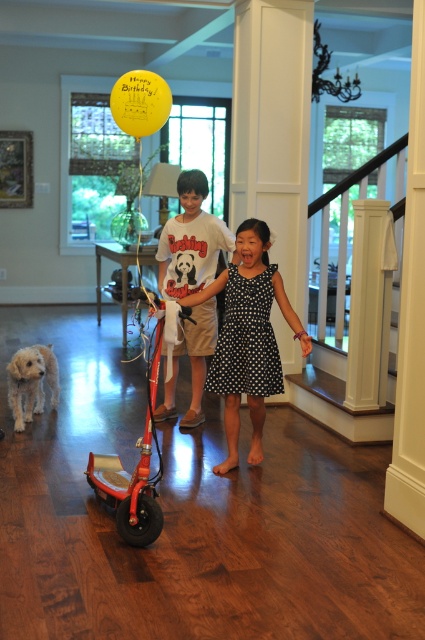
Question: Is metallic red scooter at center to the right of white fur dog at center from the viewer's perspective?

Choices:
 (A) yes
 (B) no

Answer: (B)

Question: Observing the image, what is the correct spatial positioning of white cotton t-shirt at center in reference to yellow matte balloon at upper center?

Choices:
 (A) above
 (B) below

Answer: (B)

Question: Based on their relative distances, which object is nearer to the white cotton t-shirt at center?

Choices:
 (A) white fluffy dog at lower left
 (B) metallic red scooter at center

Answer: (B)

Question: Which object is closer to the camera taking this photo?

Choices:
 (A) white cotton t-shirt at center
 (B) yellow matte balloon at upper center
 (C) white fur dog at center
 (D) black dotted dress at center

Answer: (B)

Question: Does black dotted dress at center have a larger size compared to yellow matte balloon at upper center?

Choices:
 (A) no
 (B) yes

Answer: (B)

Question: Which of the following is the farthest from the observer?

Choices:
 (A) (161, 113)
 (B) (153, 428)

Answer: (A)